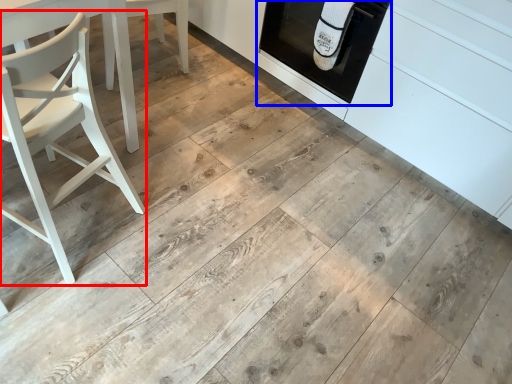
Question: Which point is further to the camera, chair (highlighted by a red box) or oven (highlighted by a blue box)?

Choices:
 (A) chair
 (B) oven

Answer: (B)